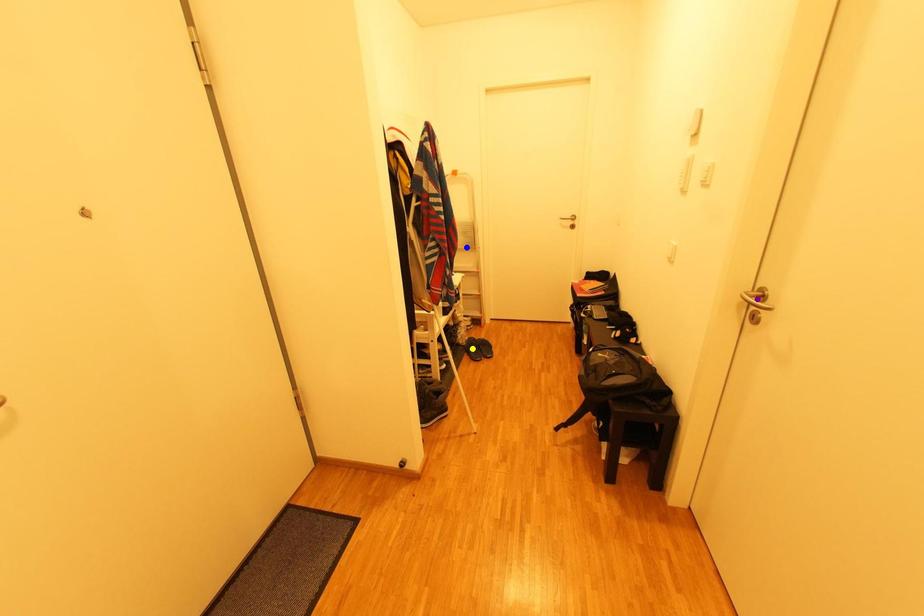
Order these from farthest to nearest:
A) yellow point
B) purple point
C) blue point

blue point < yellow point < purple point